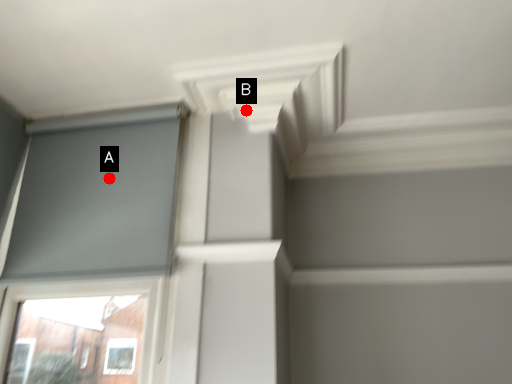
Question: Two points are circled on the image, labeled by A and B beside each circle. Which point is closer to the camera taking this photo?

Choices:
 (A) A is closer
 (B) B is closer

Answer: (A)